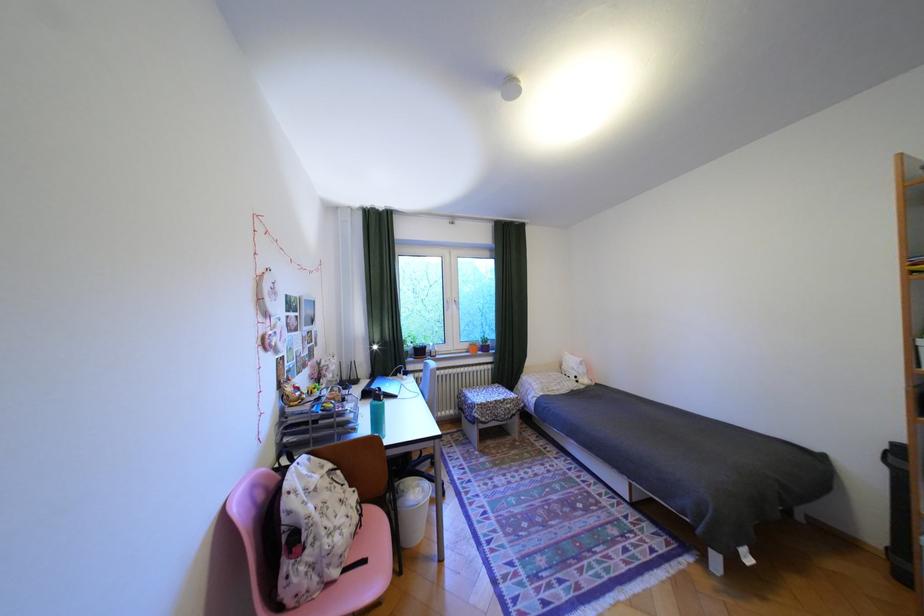
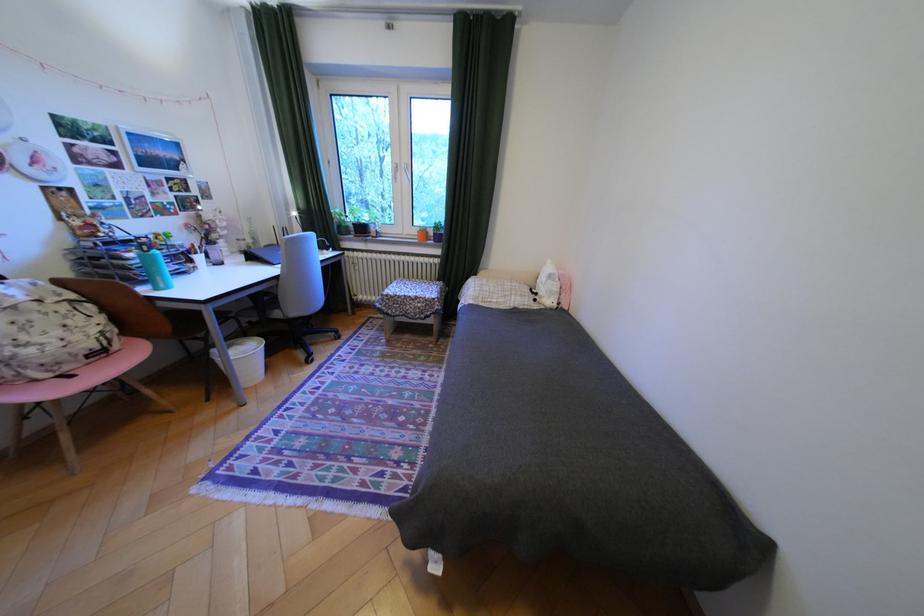
In the second image, find the point that corresponds to the point at 338,495 in the first image.

(49, 317)